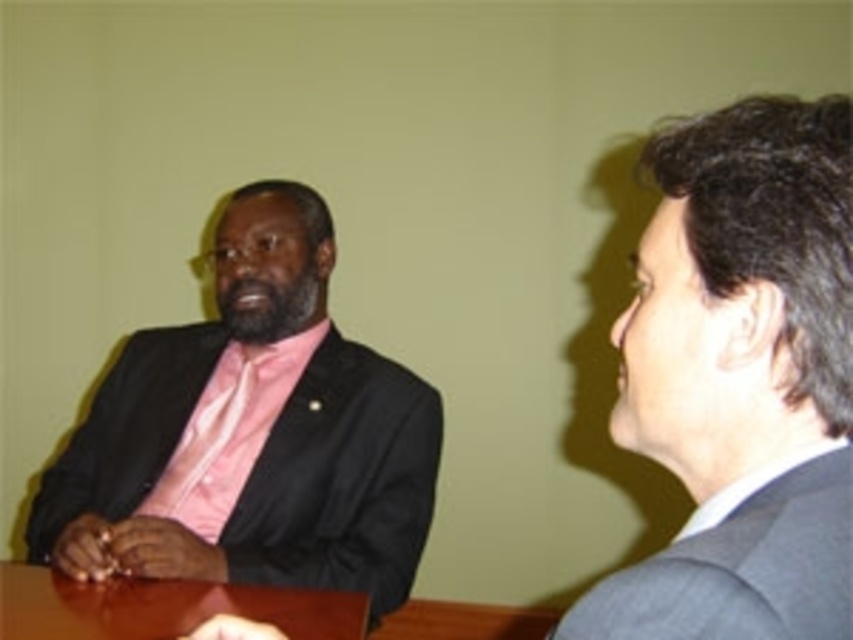
What do you see at coordinates (741, 380) in the screenshot? I see `dark brown suit at right` at bounding box center [741, 380].

Between dark brown suit at right and brown wooden table at center, which one has more height?

dark brown suit at right

Describe the element at coordinates (741, 380) in the screenshot. I see `dark brown suit at right` at that location.

Where is `dark brown suit at right`? Image resolution: width=853 pixels, height=640 pixels. dark brown suit at right is located at coordinates (741, 380).

Looking at this image, between dark brown suit at right and gray wool suit at right, which one is positioned lower?

Positioned lower is gray wool suit at right.

Can you confirm if dark brown suit at right is wider than gray wool suit at right?

Correct, the width of dark brown suit at right exceeds that of gray wool suit at right.

I want to click on dark brown suit at right, so click(741, 380).

Where is `gray wool suit at right`? This screenshot has width=853, height=640. gray wool suit at right is located at coordinates (741, 563).

Measure the distance from gray wool suit at right to brown wooden table at center.

30.85 inches

You are a GUI agent. You are given a task and a screenshot of the screen. Output one action in this format:
    pyautogui.click(x=<x>, y=<y>)
    Task: Click on the gray wool suit at right
    This screenshot has height=640, width=853.
    Given the screenshot: What is the action you would take?
    pyautogui.click(x=741, y=563)